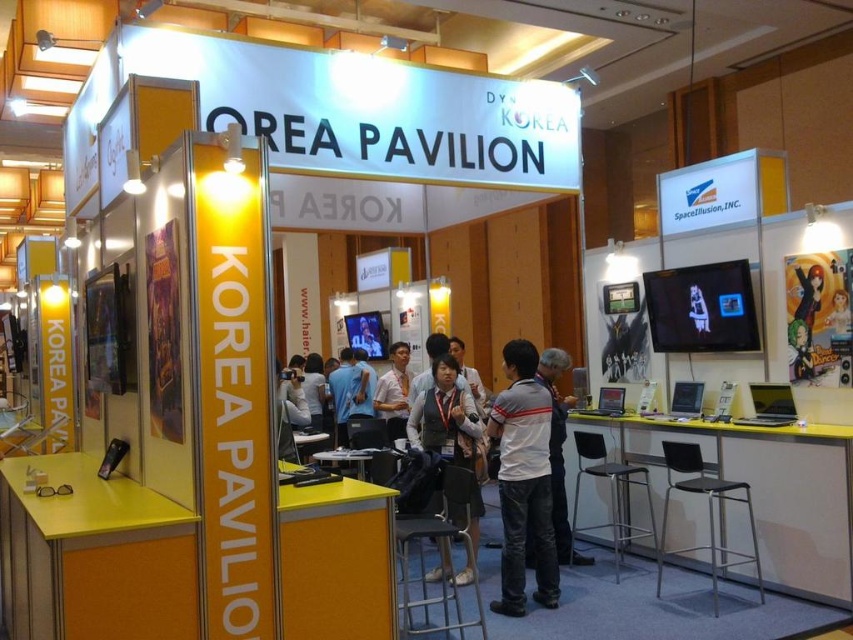
Question: Among these objects, which one is farthest from the camera?

Choices:
 (A) gray/white striped shirt at center
 (B) matte gray vest at center
 (C) white fabric jacket at center

Answer: (B)

Question: Which point is closer to the camera?

Choices:
 (A) matte gray vest at center
 (B) gray/white striped shirt at center
 (C) white fabric jacket at center

Answer: (B)

Question: Does gray/white striped shirt at center appear on the right side of matte gray vest at center?

Choices:
 (A) no
 (B) yes

Answer: (B)

Question: Can you confirm if gray/white striped shirt at center is positioned above white fabric jacket at center?

Choices:
 (A) yes
 (B) no

Answer: (A)

Question: Can you confirm if matte gray vest at center is positioned to the right of white fabric jacket at center?

Choices:
 (A) yes
 (B) no

Answer: (B)

Question: Which object is closer to the camera taking this photo?

Choices:
 (A) gray/white striped shirt at center
 (B) white fabric jacket at center
 (C) matte gray vest at center

Answer: (A)